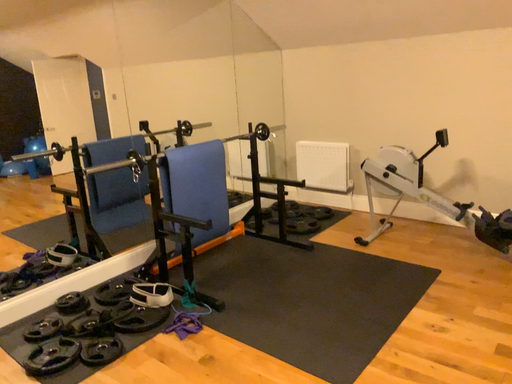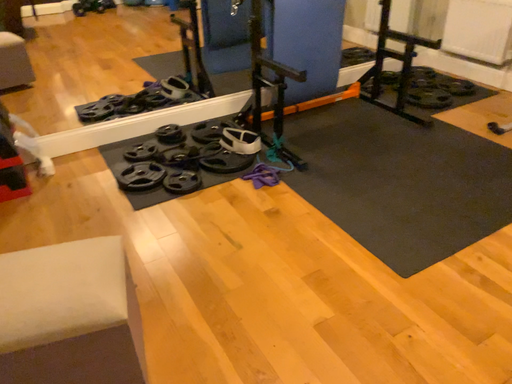
Question: Which way did the camera rotate in the video?

Choices:
 (A) rotated downward
 (B) rotated upward

Answer: (A)